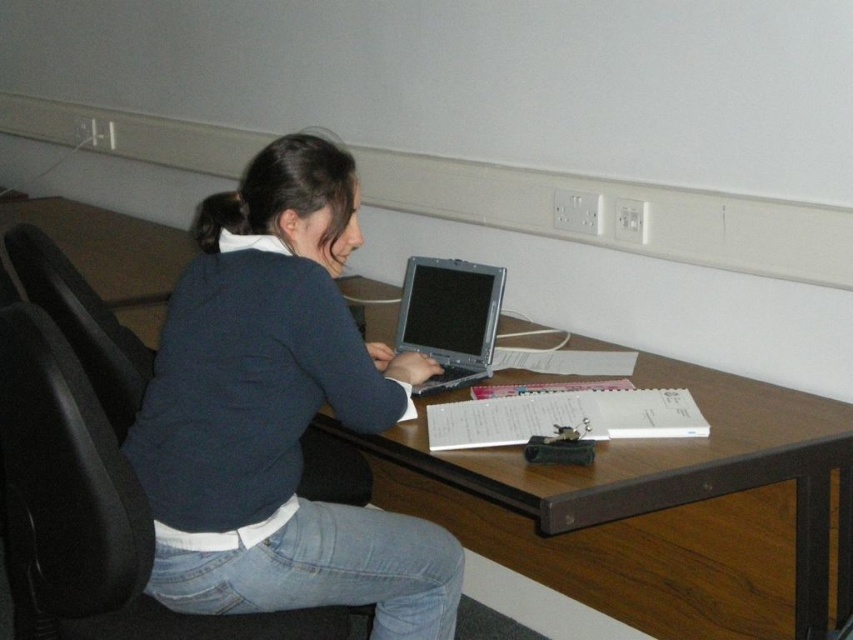
Question: Can you confirm if black leather swivel chair at left is thinner than black leather chair at left?

Choices:
 (A) no
 (B) yes

Answer: (A)

Question: Which point is closer to the camera?

Choices:
 (A) (293, 202)
 (B) (91, 513)
 (C) (486, 312)

Answer: (B)

Question: Is wooden at center below black leather swivel chair at left?

Choices:
 (A) no
 (B) yes

Answer: (B)

Question: Which of the following is the farthest from the observer?

Choices:
 (A) (294, 579)
 (B) (73, 314)
 (C) (741, 584)
 (D) (77, 541)

Answer: (C)

Question: Among these objects, which one is farthest from the camera?

Choices:
 (A) black leather chair at left
 (B) wooden at center
 (C) black leather swivel chair at left
 (D) silver metallic laptop at center

Answer: (D)

Question: Can you confirm if wooden at center is thinner than black leather swivel chair at left?

Choices:
 (A) no
 (B) yes

Answer: (A)